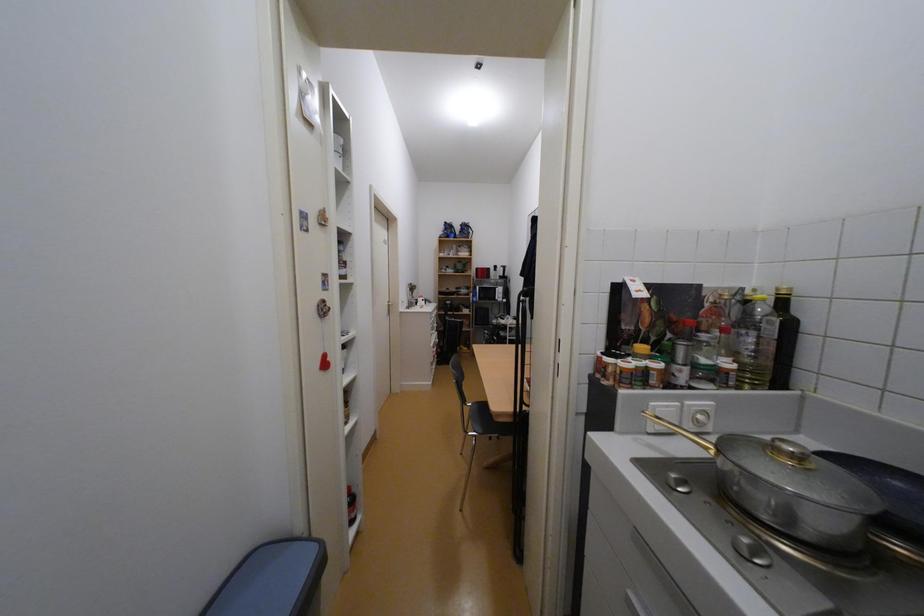
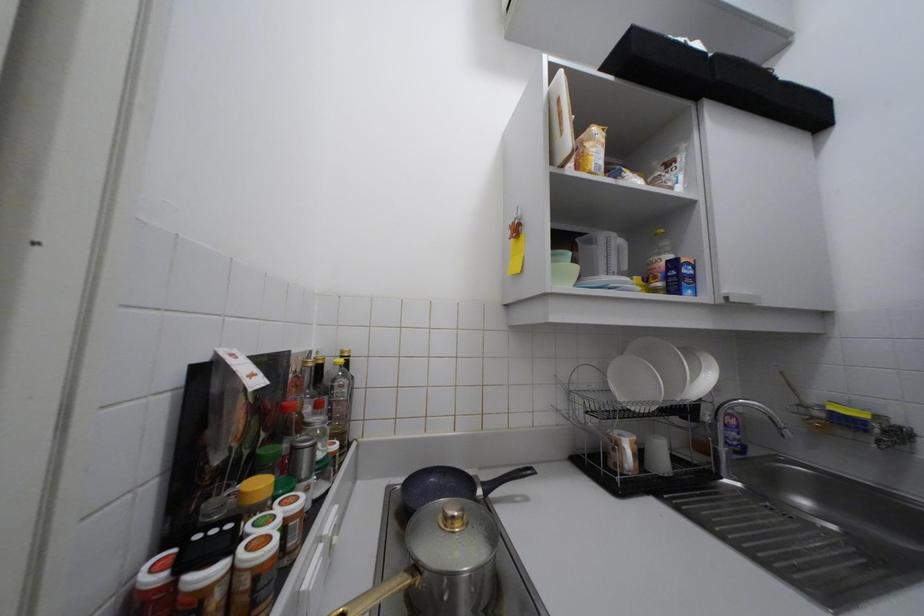
Question: The first image is from the beginning of the video and the second image is from the end. How did the camera likely rotate when shooting the video?

Choices:
 (A) Left
 (B) Right
 (C) Up
 (D) Down

Answer: (B)